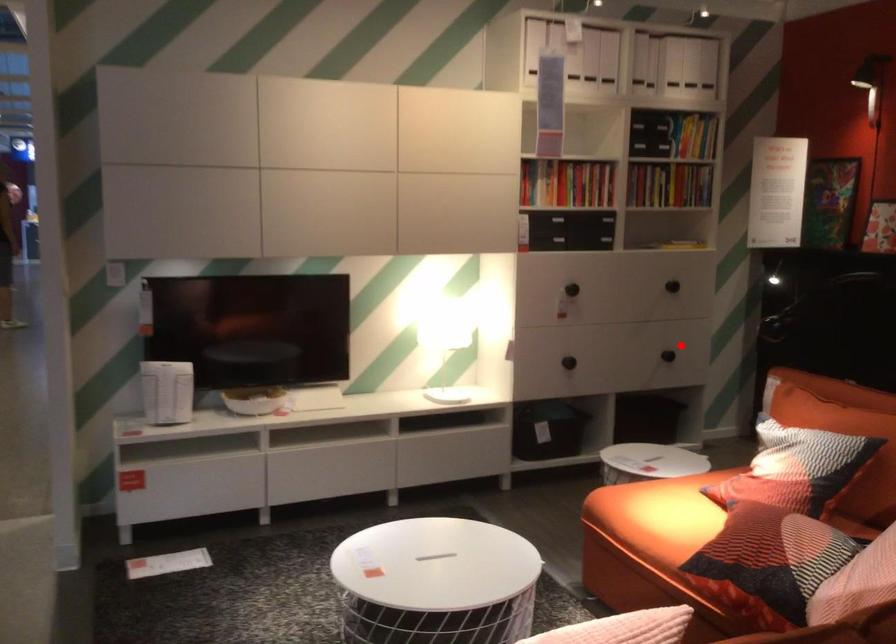
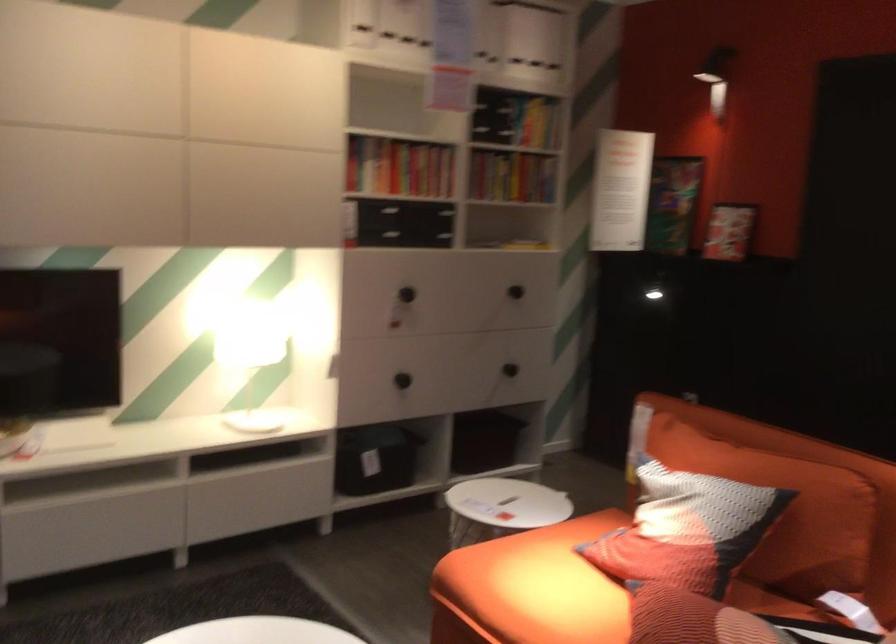
In the second image, find the point that corresponds to the highlighted location in the first image.

(510, 368)